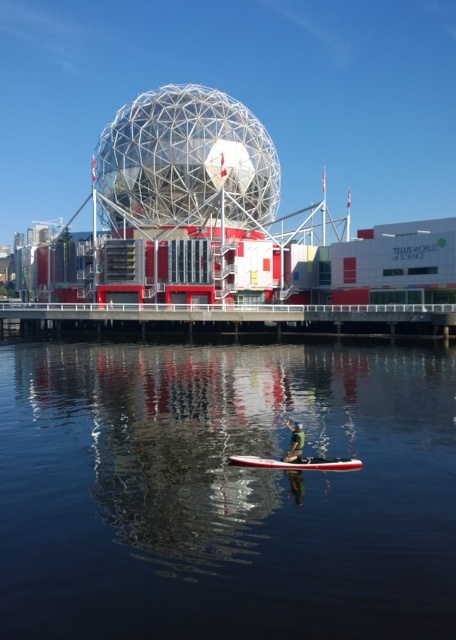
You are planning to take a photo of the transparent water at center and the white glossy canoe at center from a drone. Which object should you focus on first if you want to capture both in one shot, considering their sizes?

The transparent water at center is larger in size than the white glossy canoe at center, so you should focus on the transparent water at center first to ensure it fills the frame appropriately before adjusting for the canoe.

You are standing on the white glossy dock at center and want to reach the white glossy canoe at center. Which direction should you move to get closer to the canoe?

Since the white glossy dock at center is further to the viewer than the white glossy canoe at center, you should move forward away from the dock towards the direction of the canoe to reach it.

You are planning to dock your boat at the Telus World of Science. You see a white glossy dock at center and a white glossy canoe at center. Which object is wider?

The white glossy dock at center is wider than the white glossy canoe at center.